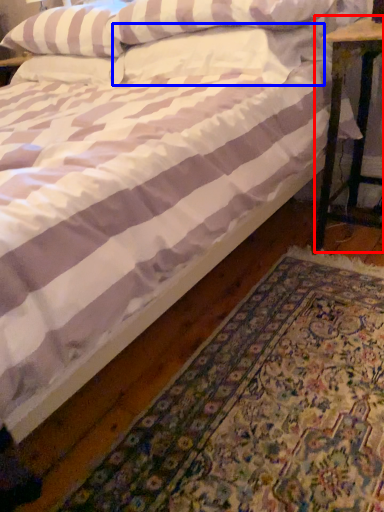
Question: Which point is closer to the camera, table (highlighted by a red box) or pillow (highlighted by a blue box)?

Choices:
 (A) table
 (B) pillow

Answer: (B)